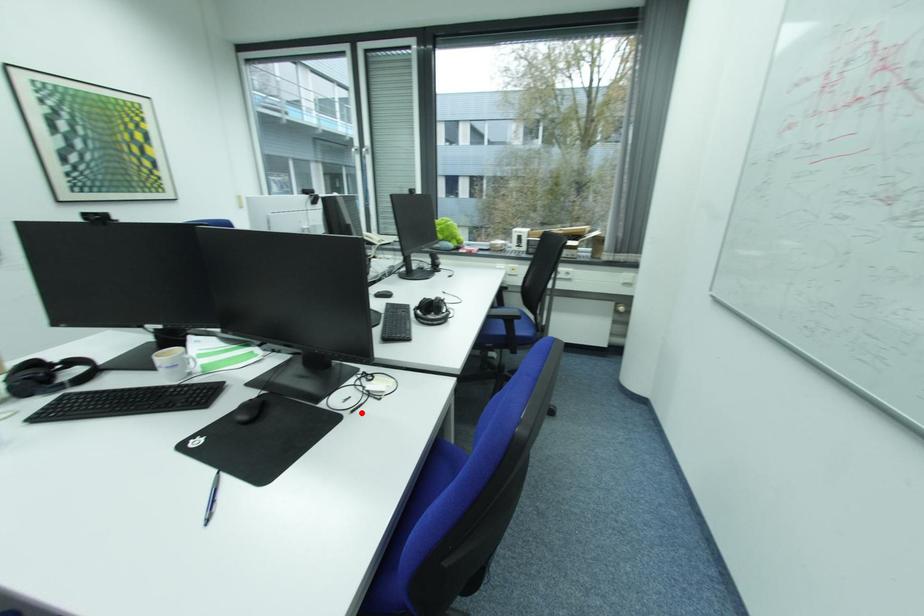
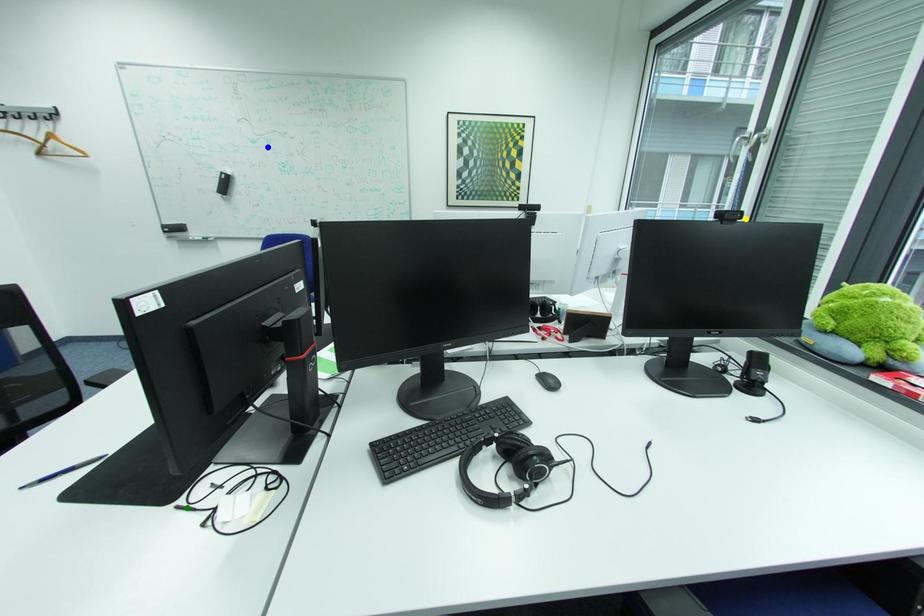
Question: I am providing you with two images of the same scene from different viewpoints. A red point is marked on the first image. You are given multiple points on the second image. Can you choose the point in image 2 that corresponds to the point in image 1?

Choices:
 (A) blue point
 (B) green point
 (C) yellow point

Answer: (B)